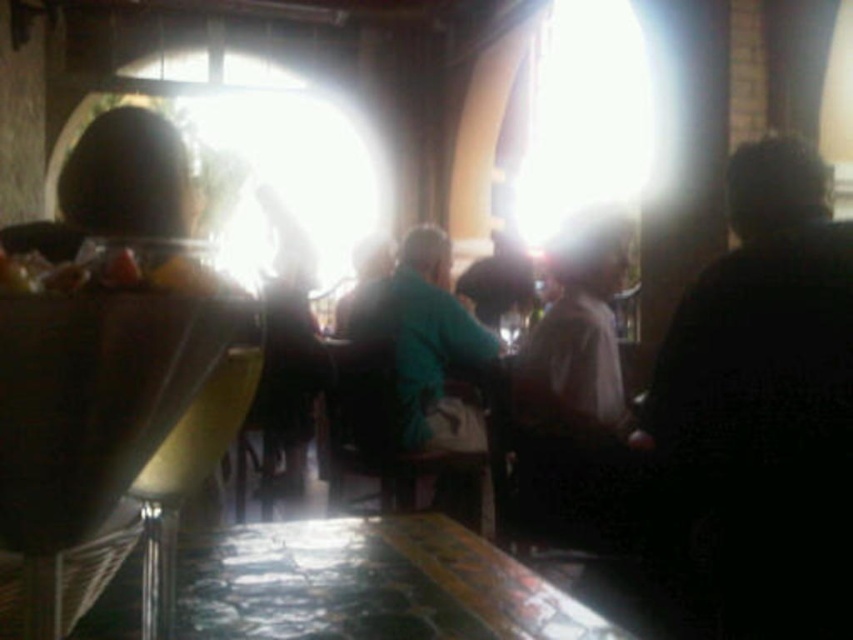
Based on the photo, is clear plastic wine glass at left wider than white fabric shirt at center?

Incorrect, clear plastic wine glass at left's width does not surpass white fabric shirt at center's.

The height and width of the screenshot is (640, 853). Identify the location of clear plastic wine glass at left. (91, 406).

The image size is (853, 640). Identify the location of clear plastic wine glass at left. tap(91, 406).

Between point (788, 216) and point (186, 493), which one is positioned in front?

Point (186, 493)

Between dark fabric shirt at right and yellow plastic cup at lower center, which one is positioned higher?

Positioned higher is yellow plastic cup at lower center.

Is point (775, 205) positioned in front of point (144, 492)?

No, (775, 205) is behind (144, 492).

In order to click on dark fabric shirt at right in this screenshot , I will do `click(766, 403)`.

The image size is (853, 640). Identify the location of white fabric shirt at center. (573, 390).

Can you confirm if white fabric shirt at center is thinner than yellow plastic cup at lower center?

No, white fabric shirt at center is not thinner than yellow plastic cup at lower center.

Does point (592, 372) come in front of point (131, 490)?

No, (592, 372) is behind (131, 490).

Identify the location of white fabric shirt at center. (573, 390).